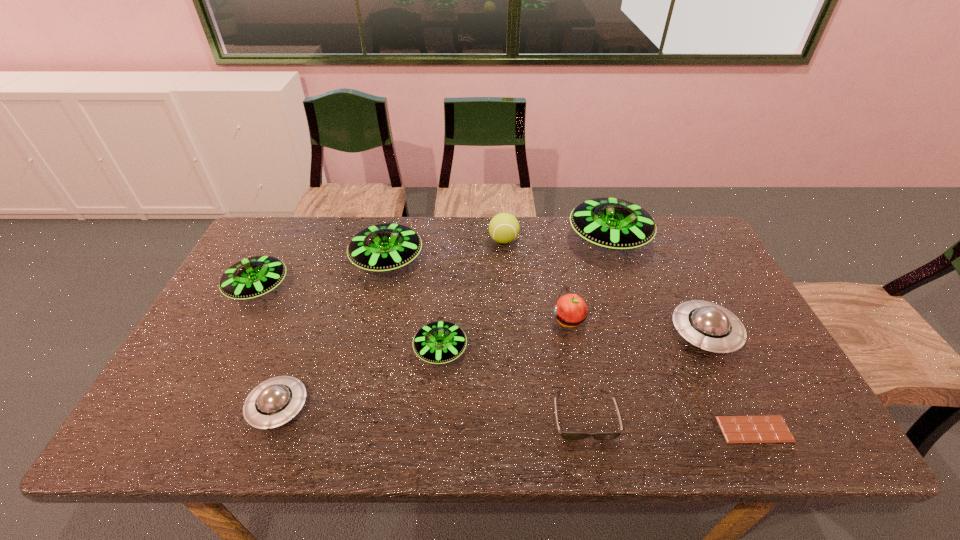
The width and height of the screenshot is (960, 540). In order to click on the biggest green saucer in this screenshot , I will do `click(617, 224)`.

I want to click on the rightmost green saucer, so click(x=617, y=224).

This screenshot has height=540, width=960. Identify the location of the third smallest green saucer. (384, 247).

Find the location of a particular element. the fifth shortest saucer is located at coordinates (384, 247).

At what (x,y) coordinates should I click in order to perform the action: click on apple. Please return your answer as a coordinate pair (x, y). Looking at the image, I should click on (570, 310).

Locate an element on the screen. The height and width of the screenshot is (540, 960). tennis ball is located at coordinates (504, 228).

What are the coordinates of `green tennis ball` in the screenshot? It's located at (504, 228).

The width and height of the screenshot is (960, 540). Identify the location of the leftmost object. (253, 277).

This screenshot has width=960, height=540. Identify the location of the leftmost green saucer. (253, 277).

The width and height of the screenshot is (960, 540). In order to click on the right gray saucer in this screenshot , I will do `click(704, 324)`.